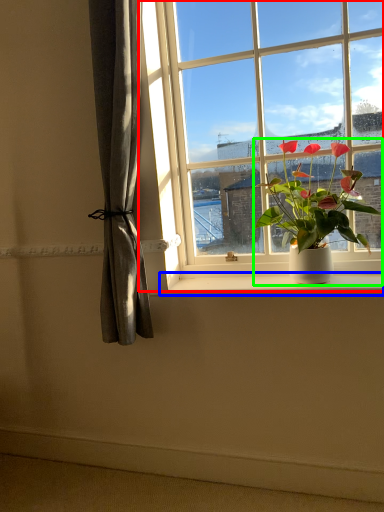
Question: Estimate the real-world distances between objects in this image. Which object is farther from window (highlighted by a red box), window sill (highlighted by a blue box) or houseplant (highlighted by a green box)?

Choices:
 (A) window sill
 (B) houseplant

Answer: (A)